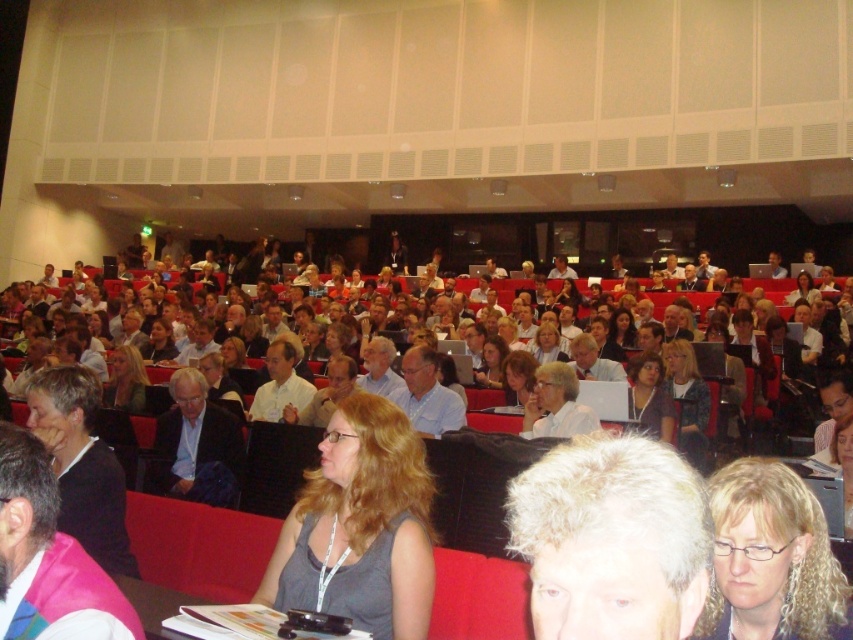
Who is positioned more to the right, blonde hair at center or white glossy shirt at center?

Positioned to the right is blonde hair at center.

Between blonde hair at center and white glossy shirt at center, which one has less height?

Standing shorter between the two is blonde hair at center.

Which is behind, point (793, 577) or point (566, 374)?

Point (566, 374)

Find the location of a particular element. This screenshot has width=853, height=640. blonde hair at center is located at coordinates (770, 560).

Does white glossy shirt at center appear on the right side of white shirt at center?

Yes, white glossy shirt at center is to the right of white shirt at center.

Measure the distance between point (561, 378) and camera.

Point (561, 378) and camera are 5.93 meters apart from each other.

Image resolution: width=853 pixels, height=640 pixels. I want to click on white glossy shirt at center, so [x=556, y=404].

Does point (397, 554) come farther from viewer compared to point (735, 544)?

That is True.

The image size is (853, 640). What do you see at coordinates (360, 525) in the screenshot?
I see `gray fabric shirt at center` at bounding box center [360, 525].

Where is `gray fabric shirt at center`? This screenshot has width=853, height=640. gray fabric shirt at center is located at coordinates (360, 525).